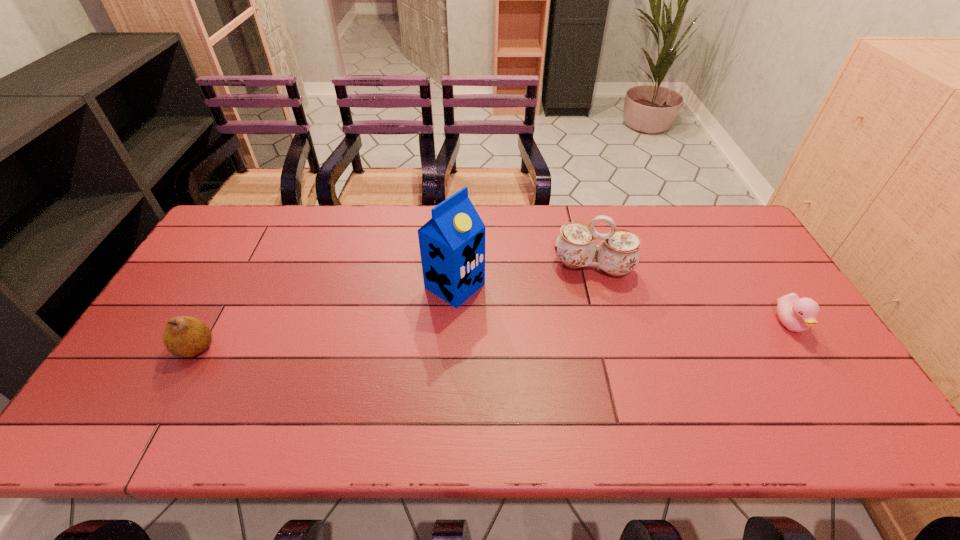
Where is `vacant space situated with the cap open on the tallest object`? This screenshot has height=540, width=960. vacant space situated with the cap open on the tallest object is located at coordinates (515, 323).

The height and width of the screenshot is (540, 960). In order to click on free space located 0.110m with the cap open on the tallest object in this screenshot , I will do `click(509, 319)`.

You are a GUI agent. You are given a task and a screenshot of the screen. Output one action in this format:
    pyautogui.click(x=<x>, y=<y>)
    Task: Click on the free location located with the cap open on the tallest object
    This screenshot has width=960, height=540.
    Given the screenshot: What is the action you would take?
    pyautogui.click(x=527, y=330)

The image size is (960, 540). In order to click on blank area located 0.090m by the handle of the second tallest object in this screenshot , I will do `click(584, 307)`.

Identify the location of blank area located by the handle of the second tallest object. (584, 304).

This screenshot has width=960, height=540. I want to click on free space located by the handle of the second tallest object, so [x=574, y=368].

The height and width of the screenshot is (540, 960). Identify the location of object that is at the far edge. (618, 254).

The image size is (960, 540). Identify the location of object positioned at the left edge. (184, 336).

Locate an element on the screen. The width and height of the screenshot is (960, 540). object located at the right edge is located at coordinates (797, 314).

I want to click on vacant space at the far edge of the desktop, so click(325, 212).